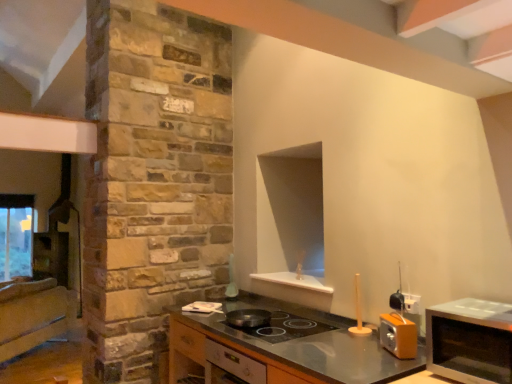
Question: Would you say satin silver microwave at right is part of shiny black frying pan at center's contents?

Choices:
 (A) no
 (B) yes

Answer: (A)

Question: Is shiny black frying pan at center with satin silver microwave at right?

Choices:
 (A) yes
 (B) no

Answer: (B)

Question: Is there a large distance between shiny black frying pan at center and satin silver microwave at right?

Choices:
 (A) yes
 (B) no

Answer: (A)

Question: From the image's perspective, would you say shiny black frying pan at center is shown under satin silver microwave at right?

Choices:
 (A) no
 (B) yes

Answer: (B)

Question: Is shiny black frying pan at center to the right of satin silver microwave at right from the viewer's perspective?

Choices:
 (A) yes
 (B) no

Answer: (B)

Question: In the image, is satin silver microwave at right positioned in front of or behind satin silver stove at center, which ranks as the second cabinetry in back-to-front order?

Choices:
 (A) behind
 (B) front

Answer: (B)

Question: Considering the positions of point (471, 339) and point (212, 362), is point (471, 339) closer or farther from the camera than point (212, 362)?

Choices:
 (A) closer
 (B) farther

Answer: (A)

Question: Based on their positions, is satin silver microwave at right located to the left or right of satin silver stove at center, placed as the 1th cabinetry when sorted from front to back?

Choices:
 (A) left
 (B) right

Answer: (B)

Question: Would you say satin silver microwave at right is inside or outside satin silver stove at center, placed as the 1th cabinetry when sorted from front to back?

Choices:
 (A) inside
 (B) outside

Answer: (B)

Question: Is metallic gray countertop at center bigger or smaller than shiny black frying pan at center?

Choices:
 (A) big
 (B) small

Answer: (A)

Question: From the image's perspective, is metallic gray countertop at center positioned above or below shiny black frying pan at center?

Choices:
 (A) below
 (B) above

Answer: (A)

Question: Is metallic gray countertop at center taller or shorter than shiny black frying pan at center?

Choices:
 (A) tall
 (B) short

Answer: (A)

Question: Relative to shiny black frying pan at center, is metallic gray countertop at center in front or behind?

Choices:
 (A) behind
 (B) front

Answer: (B)

Question: Is wooden cabinet at left, which ranks as the 1th cabinetry in back-to-front order, spatially inside satin silver stove at center, acting as the first cabinetry starting from the right, or outside of it?

Choices:
 (A) inside
 (B) outside

Answer: (B)

Question: From a real-world perspective, is wooden cabinet at left, which ranks as the 1th cabinetry in back-to-front order, physically located above or below satin silver stove at center, acting as the first cabinetry starting from the right?

Choices:
 (A) below
 (B) above

Answer: (A)